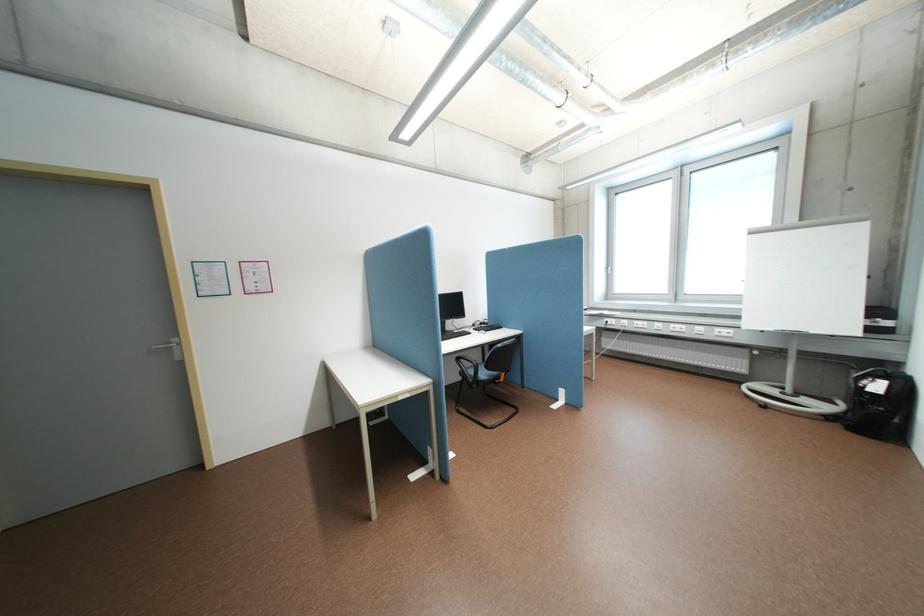
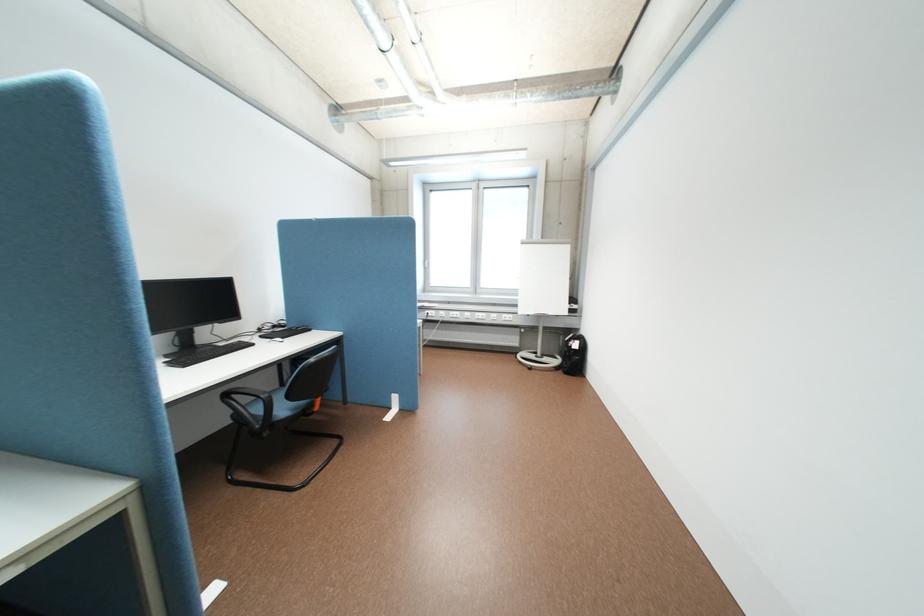
Question: The camera is either moving clockwise (left) or counter-clockwise (right) around the object. The first image is from the beginning of the video and the second image is from the end. Is the camera moving left or right when shooting the video?

Choices:
 (A) Left
 (B) Right

Answer: (A)